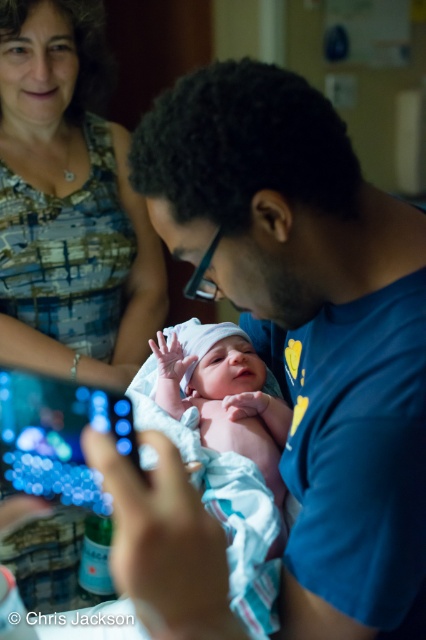
Question: Can you confirm if blue printed fabric at upper left is smaller than white clothed newborn at center?

Choices:
 (A) yes
 (B) no

Answer: (B)

Question: Does blue printed fabric at upper left appear on the right side of white clothed newborn at center?

Choices:
 (A) no
 (B) yes

Answer: (A)

Question: Which point appears farthest from the camera in this image?

Choices:
 (A) (224, 372)
 (B) (92, 74)

Answer: (B)

Question: Which point appears farthest from the camera in this image?

Choices:
 (A) (172, 340)
 (B) (54, 228)

Answer: (B)

Question: Is blue printed fabric at upper left closer to the viewer compared to white clothed newborn at center?

Choices:
 (A) no
 (B) yes

Answer: (A)

Question: Which point is closer to the camera?

Choices:
 (A) blue printed fabric at upper left
 (B) white clothed newborn at center

Answer: (B)